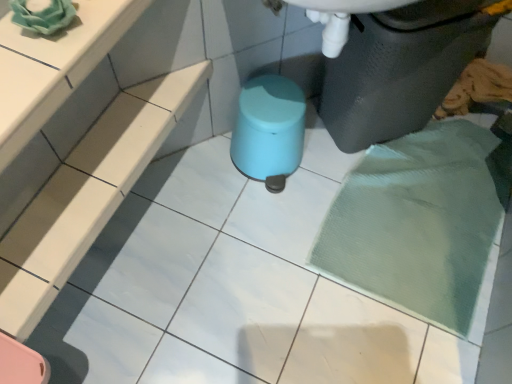
Question: From a real-world perspective, is matte plastic waste container at lower right physically below mint glossy stool at center?

Choices:
 (A) no
 (B) yes

Answer: (A)

Question: Could you tell me if matte plastic waste container at lower right is turned towards mint glossy stool at center?

Choices:
 (A) yes
 (B) no

Answer: (B)

Question: Is matte plastic waste container at lower right further to camera compared to mint glossy stool at center?

Choices:
 (A) no
 (B) yes

Answer: (A)

Question: Is matte plastic waste container at lower right bigger than mint glossy stool at center?

Choices:
 (A) yes
 (B) no

Answer: (A)

Question: From the image's perspective, does matte plastic waste container at lower right appear lower than mint glossy stool at center?

Choices:
 (A) no
 (B) yes

Answer: (A)

Question: Are matte plastic waste container at lower right and mint glossy stool at center far apart?

Choices:
 (A) no
 (B) yes

Answer: (A)

Question: Does mint glossy stool at center have a larger size compared to matte plastic waste container at lower right?

Choices:
 (A) yes
 (B) no

Answer: (B)

Question: Does mint glossy stool at center have a greater height compared to matte plastic waste container at lower right?

Choices:
 (A) yes
 (B) no

Answer: (B)

Question: From a real-world perspective, is mint glossy stool at center on matte plastic waste container at lower right?

Choices:
 (A) no
 (B) yes

Answer: (A)

Question: Does mint glossy stool at center turn towards matte plastic waste container at lower right?

Choices:
 (A) yes
 (B) no

Answer: (B)

Question: From the image's perspective, is mint glossy stool at center on matte plastic waste container at lower right?

Choices:
 (A) no
 (B) yes

Answer: (A)

Question: Is mint glossy stool at center shorter than matte plastic waste container at lower right?

Choices:
 (A) no
 (B) yes

Answer: (B)

Question: Is matte plastic waste container at lower right inside or outside of mint glossy stool at center?

Choices:
 (A) inside
 (B) outside

Answer: (B)